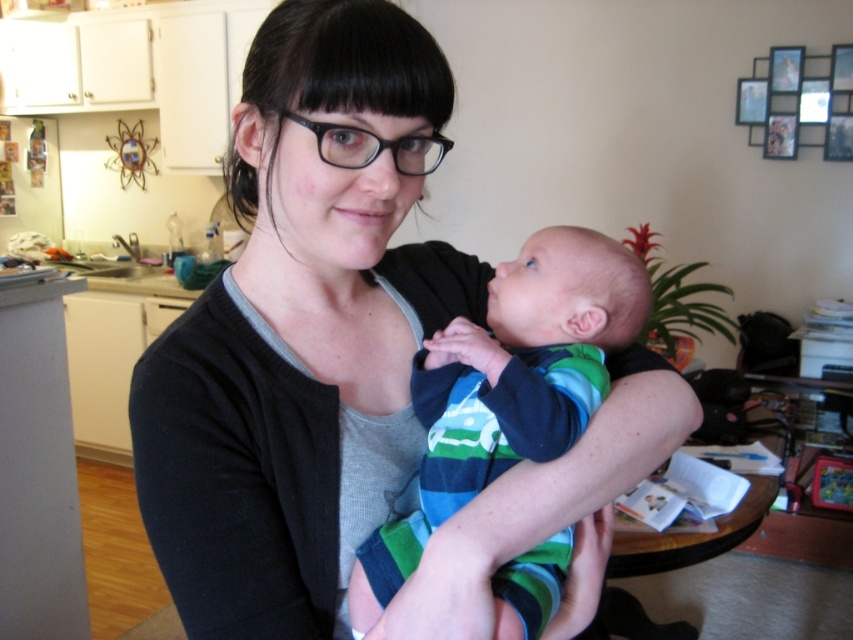
Question: Which of the following is the farthest from the observer?

Choices:
 (A) striped cotton onesie at center
 (B) black matte cardigan at center

Answer: (A)

Question: Does black matte cardigan at center have a smaller size compared to striped cotton onesie at center?

Choices:
 (A) yes
 (B) no

Answer: (B)

Question: Is black matte cardigan at center positioned before striped cotton onesie at center?

Choices:
 (A) yes
 (B) no

Answer: (A)

Question: Does black matte cardigan at center have a lesser width compared to striped cotton onesie at center?

Choices:
 (A) yes
 (B) no

Answer: (B)

Question: Which of the following is the closest to the observer?

Choices:
 (A) striped cotton onesie at center
 (B) black matte cardigan at center

Answer: (B)

Question: Which point is farther to the camera?

Choices:
 (A) black matte cardigan at center
 (B) striped cotton onesie at center

Answer: (B)